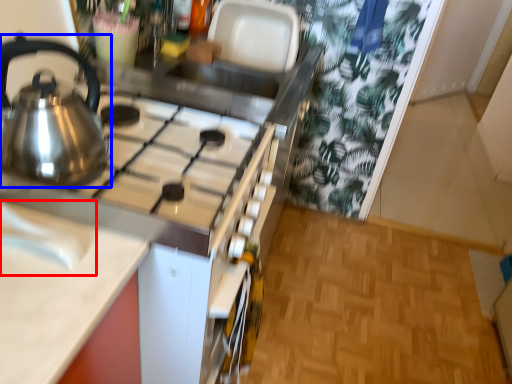
Question: Which object is closer to the camera taking this photo, sink (highlighted by a red box) or kettle (highlighted by a blue box)?

Choices:
 (A) sink
 (B) kettle

Answer: (A)